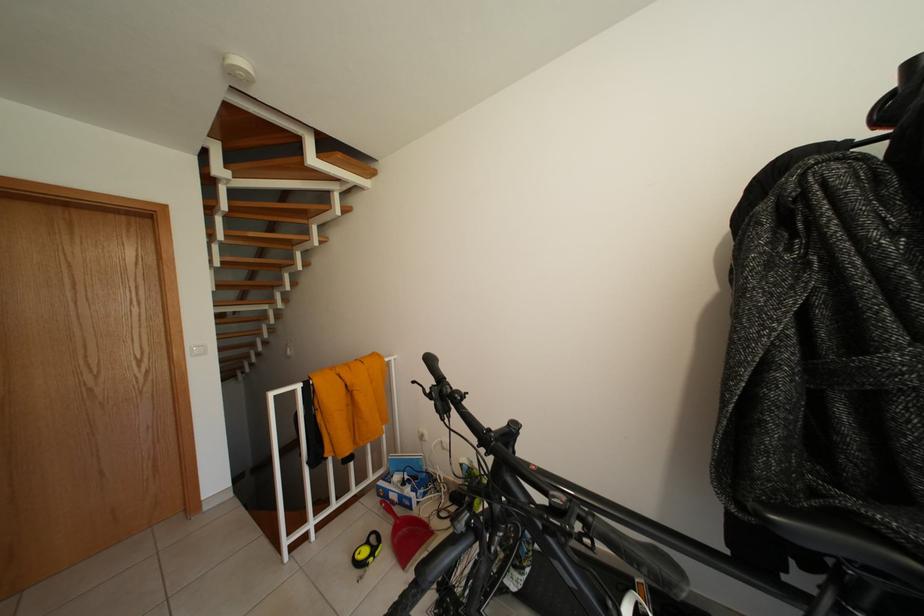
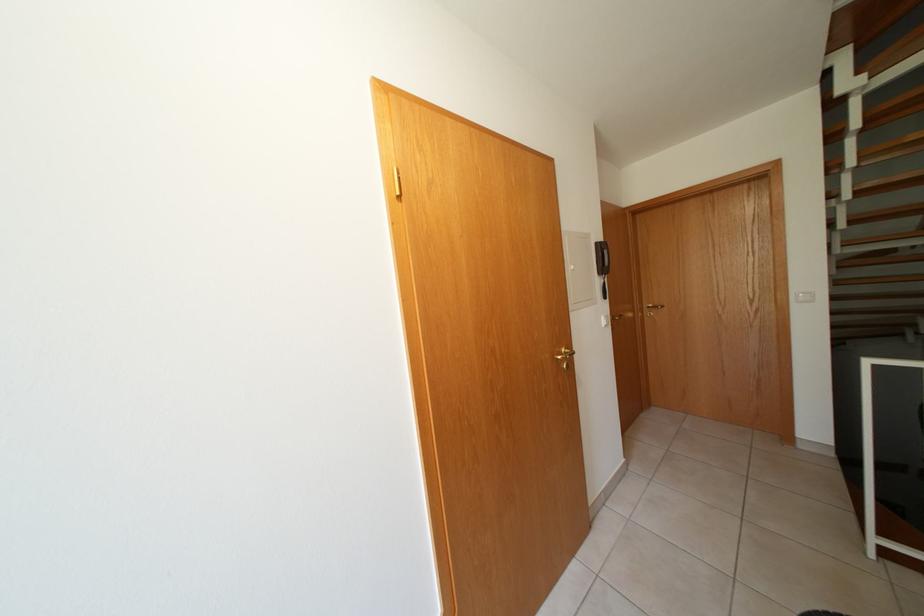
Question: The first image is from the beginning of the video and the second image is from the end. How did the camera likely rotate when shooting the video?

Choices:
 (A) Left
 (B) Right
 (C) Up
 (D) Down

Answer: (A)